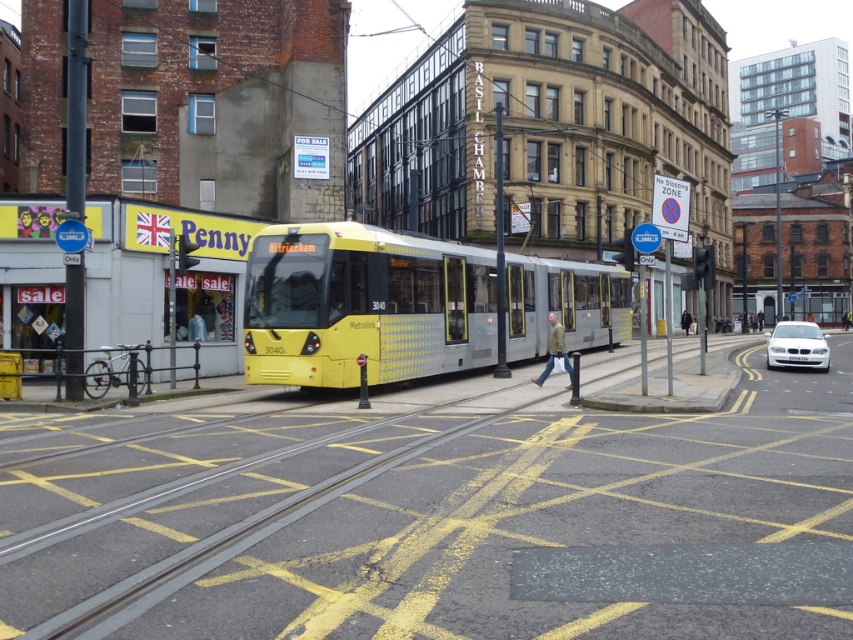
Question: Is yellow metallic tram at center to the left of white glossy car at lower right from the viewer's perspective?

Choices:
 (A) no
 (B) yes

Answer: (B)

Question: Observing the image, what is the correct spatial positioning of yellow metallic tram at center in reference to white glossy car at lower right?

Choices:
 (A) right
 (B) left

Answer: (B)

Question: Is yellow metallic tram at center wider than white glossy car at lower right?

Choices:
 (A) no
 (B) yes

Answer: (B)

Question: Which of the following is the farthest from the observer?

Choices:
 (A) (798, 333)
 (B) (309, 380)

Answer: (A)